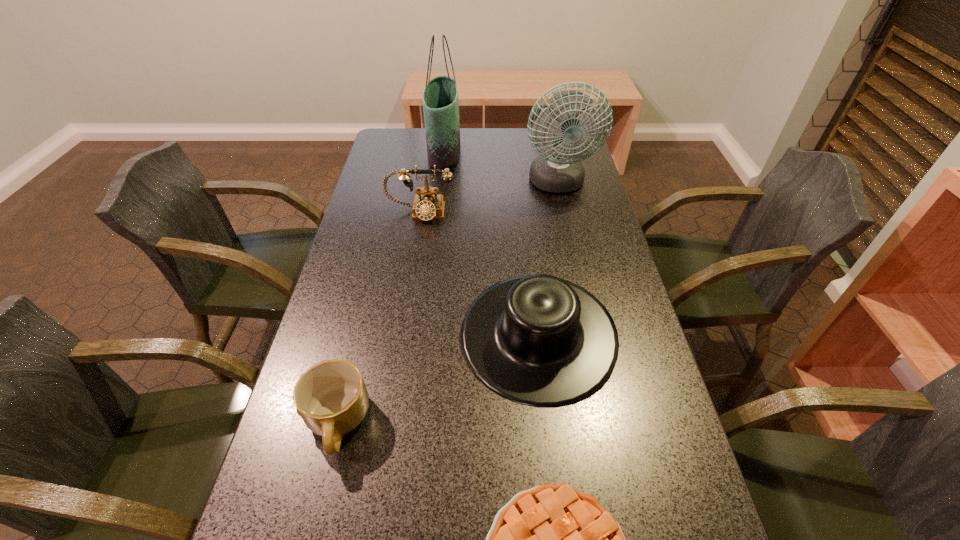
Locate an element on the screen. The width and height of the screenshot is (960, 540). object at the far edge is located at coordinates (440, 97).

Locate an element on the screen. The image size is (960, 540). telephone located at the left edge is located at coordinates (427, 205).

The image size is (960, 540). I want to click on mug at the left edge, so click(x=331, y=397).

You are a GUI agent. You are given a task and a screenshot of the screen. Output one action in this format:
    pyautogui.click(x=<x>, y=<y>)
    Task: Click on the fan that is at the right edge
    This screenshot has height=540, width=960.
    Given the screenshot: What is the action you would take?
    pyautogui.click(x=560, y=171)

Find the location of a particular element. dress hat at the right edge is located at coordinates (539, 340).

Where is `vacant space at the left edge of the desktop`? vacant space at the left edge of the desktop is located at coordinates (282, 441).

Find the location of a particular element. vacant space at the right edge of the desktop is located at coordinates (564, 226).

In the image, there is a desktop. At what (x,y) coordinates should I click in order to perform the action: click on vacant space at the far left corner. Please return your answer as a coordinate pair (x, y). The height and width of the screenshot is (540, 960). Looking at the image, I should click on (379, 160).

The width and height of the screenshot is (960, 540). Identify the location of free space between the second shortest object and the tote bag. (391, 287).

The height and width of the screenshot is (540, 960). I want to click on free space between the second shortest object and the tote bag, so click(x=391, y=287).